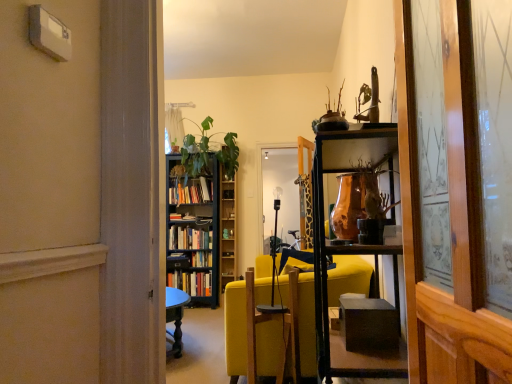
Question: Looking at their shapes, would you say wooden swivel chair at center is wider or thinner than black wooden bookcase at center?

Choices:
 (A) wide
 (B) thin

Answer: (B)

Question: From the image's perspective, relative to black wooden bookcase at center, is wooden swivel chair at center above or below?

Choices:
 (A) below
 (B) above

Answer: (A)

Question: Estimate the real-world distances between objects in this image. Which object is closer to the hardcover books at center, marked as the first book in a top-to-bottom arrangement?

Choices:
 (A) black wooden bookcase at center
 (B) hardcover books at center, the first book from the bottom
 (C) green matte bookshelf at center
 (D) yellow fabric couch at center
 (E) copper metallic vase at center

Answer: (A)

Question: Based on their relative distances, which object is nearer to the hardcover books at center, which is counted as the third book, starting from the top?

Choices:
 (A) black wooden bookcase at center
 (B) hardcover books at center, which is the 3th book from bottom to top
 (C) copper metallic vase at center
 (D) wooden swivel chair at center
 (E) green matte bookshelf at center

Answer: (A)